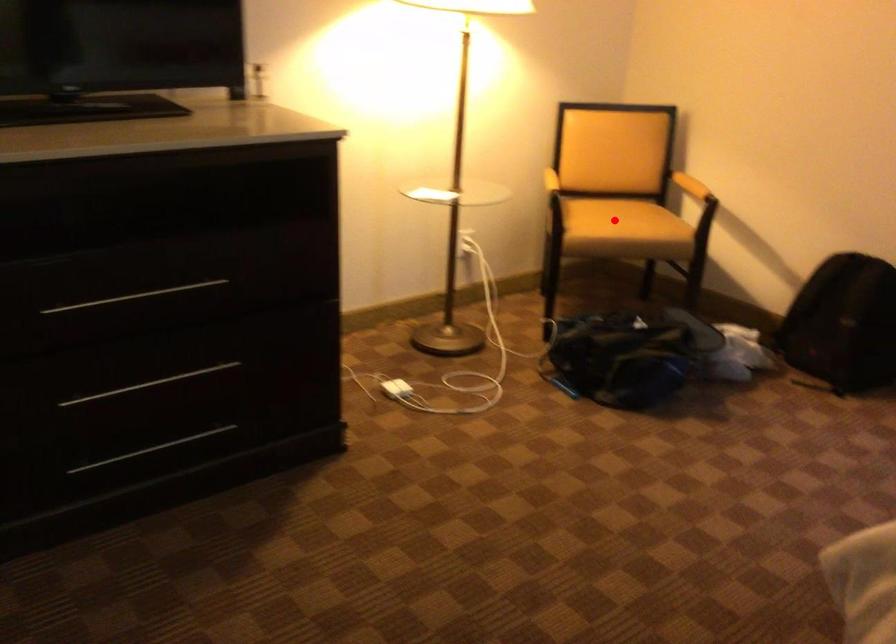
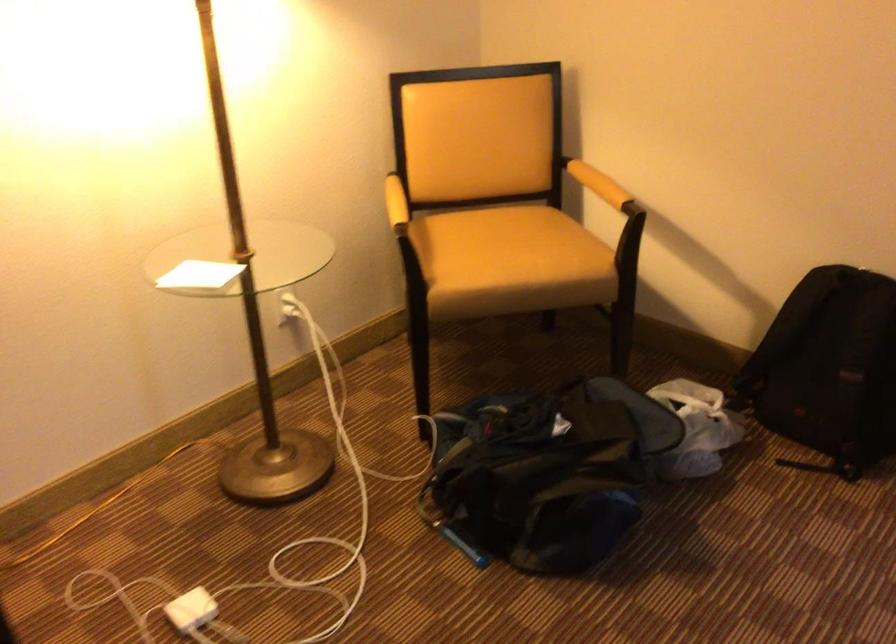
In the second image, find the point that corresponds to the highlighted location in the first image.

(510, 261)